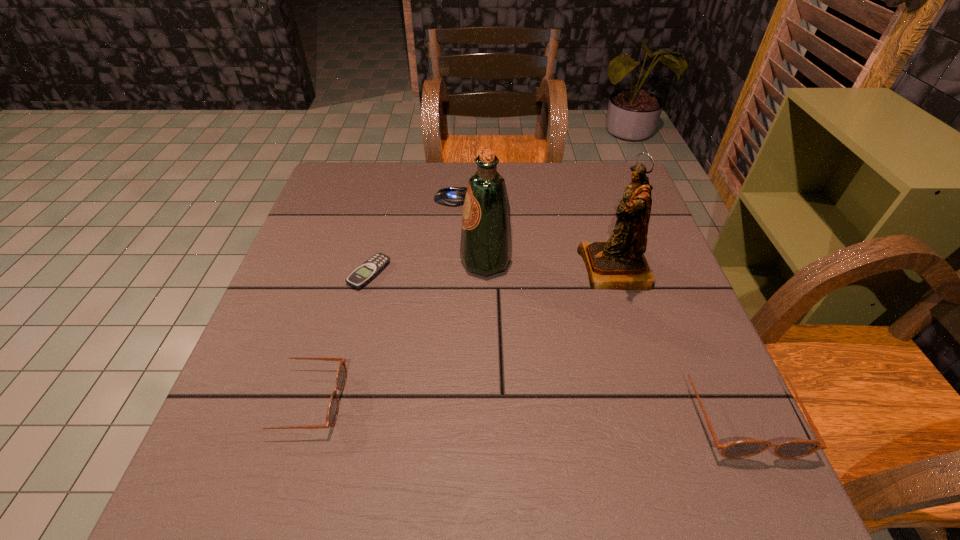
Locate an element on the screen. free space at the far right corner of the desktop is located at coordinates (604, 184).

Image resolution: width=960 pixels, height=540 pixels. I want to click on free space between the computer mouse and the figurine, so coord(535,234).

The width and height of the screenshot is (960, 540). What are the coordinates of `free area in between the fifth tallest object and the fourth shortest object` in the screenshot? It's located at (597, 305).

Where is `blank region between the shortest object and the computer mouse`? This screenshot has height=540, width=960. blank region between the shortest object and the computer mouse is located at coordinates (412, 236).

This screenshot has width=960, height=540. What are the coordinates of `free space between the figurine and the right sunglasses` in the screenshot? It's located at click(677, 340).

Identify the location of free space between the figurine and the taller sunglasses. The image size is (960, 540). (677, 340).

Image resolution: width=960 pixels, height=540 pixels. In order to click on free space between the beeper and the farthest object in this screenshot , I will do `click(412, 236)`.

Image resolution: width=960 pixels, height=540 pixels. Identify the location of vacant area that lies between the shorter sunglasses and the farthest object. (379, 300).

What are the coordinates of `free space between the farthest object and the fourth shortest object` in the screenshot? It's located at (597, 305).

Where is `free space between the fourth tallest object and the shortest object`? free space between the fourth tallest object and the shortest object is located at coordinates (336, 337).